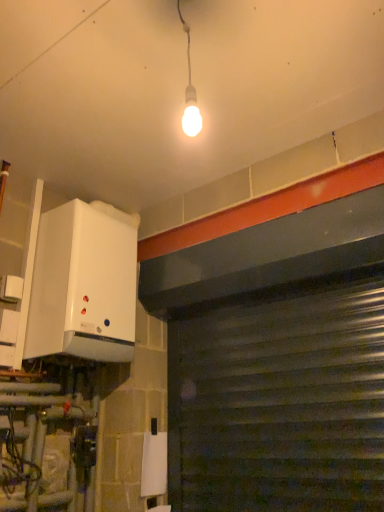
Question: Is metallic gray garage door at lower right to the right of white matte boiler at left from the viewer's perspective?

Choices:
 (A) no
 (B) yes

Answer: (B)

Question: Is metallic gray garage door at lower right directly adjacent to white matte boiler at left?

Choices:
 (A) no
 (B) yes

Answer: (A)

Question: Can you confirm if metallic gray garage door at lower right is bigger than white matte boiler at left?

Choices:
 (A) yes
 (B) no

Answer: (B)

Question: Can you confirm if metallic gray garage door at lower right is smaller than white matte boiler at left?

Choices:
 (A) yes
 (B) no

Answer: (A)

Question: Is metallic gray garage door at lower right wider than white matte boiler at left?

Choices:
 (A) yes
 (B) no

Answer: (B)

Question: Does metallic gray garage door at lower right come in front of white matte boiler at left?

Choices:
 (A) no
 (B) yes

Answer: (B)

Question: Considering the relative positions of white matte boiler at left and metallic gray garage door at lower right in the image provided, is white matte boiler at left to the left of metallic gray garage door at lower right from the viewer's perspective?

Choices:
 (A) no
 (B) yes

Answer: (B)

Question: From a real-world perspective, does white matte boiler at left stand above metallic gray garage door at lower right?

Choices:
 (A) yes
 (B) no

Answer: (A)

Question: Can you confirm if white matte boiler at left is taller than metallic gray garage door at lower right?

Choices:
 (A) no
 (B) yes

Answer: (A)

Question: Is metallic gray garage door at lower right surrounded by white matte boiler at left?

Choices:
 (A) yes
 (B) no

Answer: (B)

Question: Is white matte boiler at left at the right side of metallic gray garage door at lower right?

Choices:
 (A) yes
 (B) no

Answer: (B)

Question: Is white matte boiler at left positioned far away from metallic gray garage door at lower right?

Choices:
 (A) no
 (B) yes

Answer: (A)

Question: From the image's perspective, is metallic gray garage door at lower right above or below white matte boiler at left?

Choices:
 (A) below
 (B) above

Answer: (A)